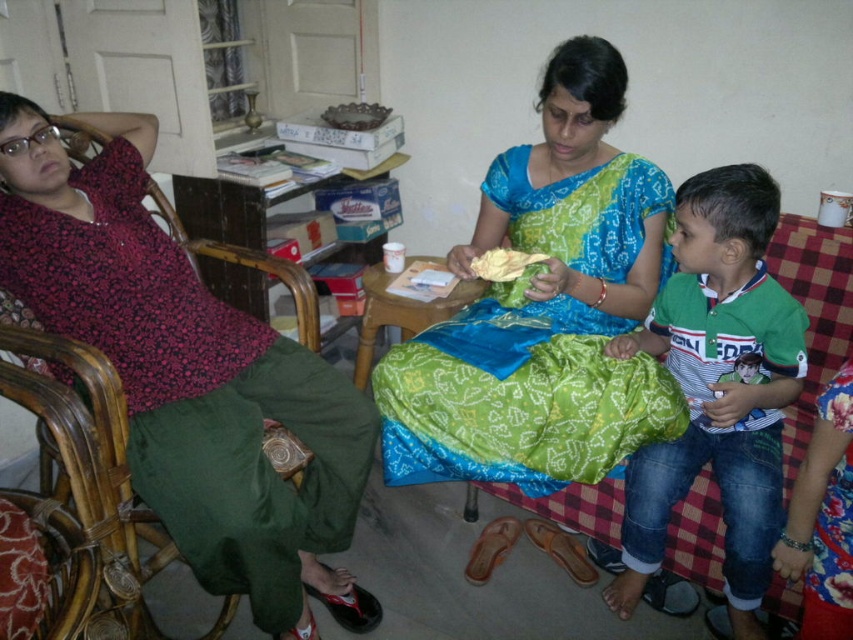
Looking at this image, you are a photographer standing at the camera position. You want to place a 1.5 meter long tripod between the wooden table at center and the camera. Is there enough space to place the tripod without it overlapping with either the table or the camera?

The wooden table at center and the camera are 2.00 meters apart, so yes, the tripod can be placed between them as the distance is sufficient to accommodate the 1.5 meter length without overlapping.

In the scene shown: What is the exact position of the wooden table at center in the image?

The wooden table at center is located at point (401,314).

In the scene shown: What color are the pants of the person sitting at point (189, 376)?

The pants at point (189, 376) are matte green.